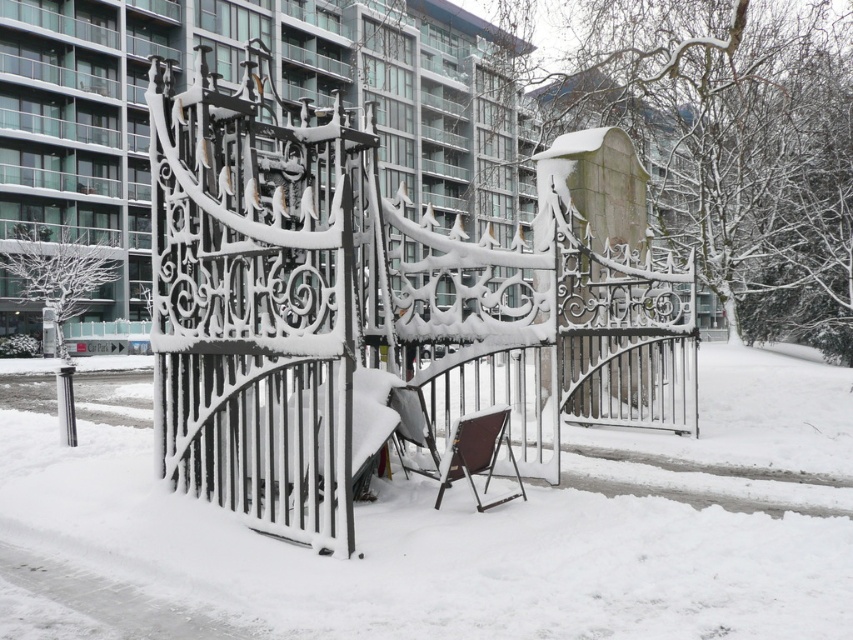
Who is taller, snow-covered wrought iron gate at center or brown fabric chair at center?

Standing taller between the two is snow-covered wrought iron gate at center.

Consider the image. Does snow-covered wrought iron gate at center come behind brown fabric chair at center?

No.

What do you see at coordinates (372, 316) in the screenshot? I see `snow-covered wrought iron gate at center` at bounding box center [372, 316].

Identify the location of snow-covered wrought iron gate at center. The image size is (853, 640). (372, 316).

Is snow-covered wrought iron gate at center shorter than white matte snow at center?

Incorrect, snow-covered wrought iron gate at center's height does not fall short of white matte snow at center's.

Between snow-covered wrought iron gate at center and white matte snow at center, which one has more height?

With more height is snow-covered wrought iron gate at center.

Which is behind, point (560, 394) or point (454, 508)?

The point (560, 394) is behind.

At what (x,y) coordinates should I click in order to perform the action: click on snow-covered wrought iron gate at center. Please return your answer as a coordinate pair (x, y). Looking at the image, I should click on (372, 316).

In the scene shown: Which is below, white matte snow at center or brown fabric chair at center?

white matte snow at center is lower down.

Which is more to the right, white matte snow at center or brown fabric chair at center?

white matte snow at center

Is point (627, 609) behind point (419, 470)?

No.

Where is `white matte snow at center`? This screenshot has width=853, height=640. white matte snow at center is located at coordinates (431, 554).